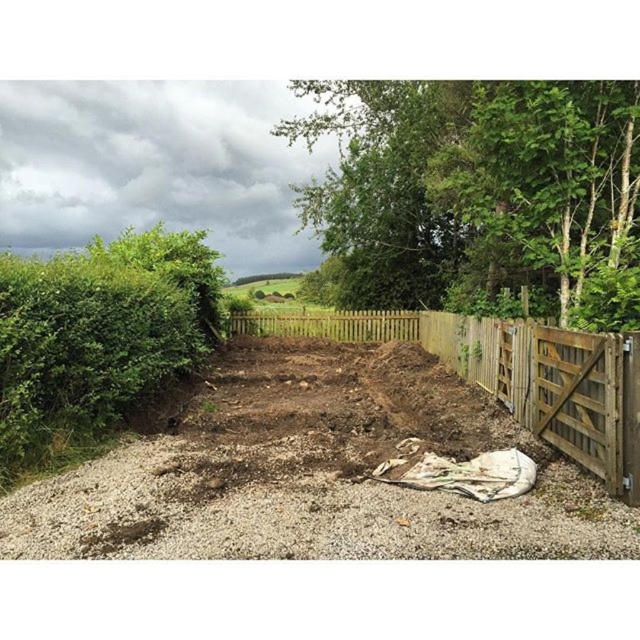
Which is more to the left, green leafy tree at upper right or wooden gate at center?

From the viewer's perspective, wooden gate at center appears more on the left side.

Image resolution: width=640 pixels, height=640 pixels. What do you see at coordinates (477, 195) in the screenshot? I see `green leafy tree at upper right` at bounding box center [477, 195].

Is point (380, 147) positioned before point (627, 472)?

That is False.

This screenshot has height=640, width=640. In order to click on green leafy tree at upper right in this screenshot , I will do `click(477, 195)`.

Who is taller, brown soil at center or wooden gate at center?

wooden gate at center is taller.

Based on the photo, is brown soil at center wider than wooden gate at center?

In fact, brown soil at center might be narrower than wooden gate at center.

Is point (234, 520) in front of point (326, 328)?

Yes, it is in front of point (326, 328).

I want to click on brown soil at center, so click(x=314, y=472).

Is point (116, 534) farther from viewer compared to point (77, 268)?

No, it is in front of (77, 268).

Can you confirm if brown soil at center is bigger than green leafy hedge at left?

Incorrect, brown soil at center is not larger than green leafy hedge at left.

Which is in front, point (561, 458) or point (100, 260)?

Positioned in front is point (561, 458).

Find the location of a particular element. brown soil at center is located at coordinates (314, 472).